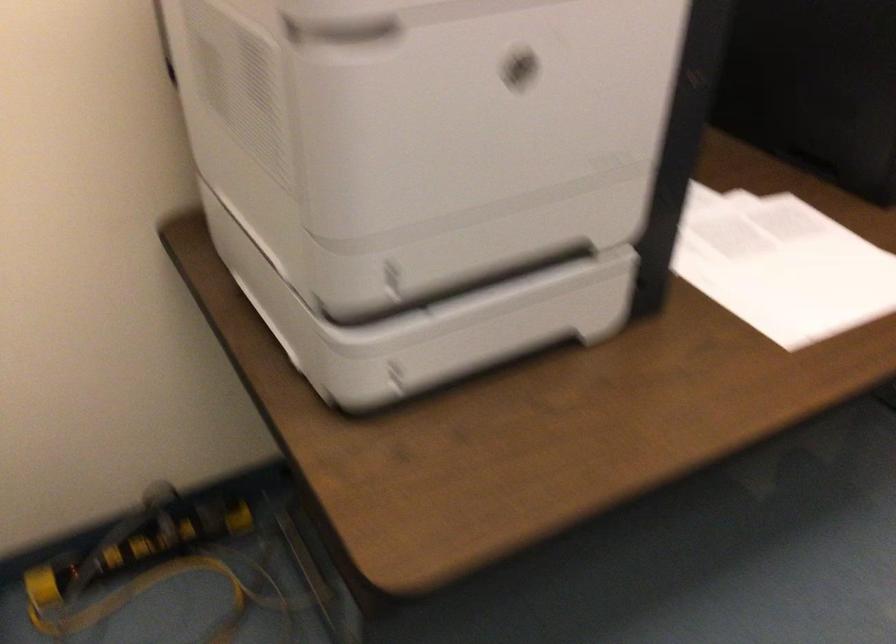
Where would you pull the printer tray handle? Please return your answer as a coordinate pair (x, y).

(540, 69)